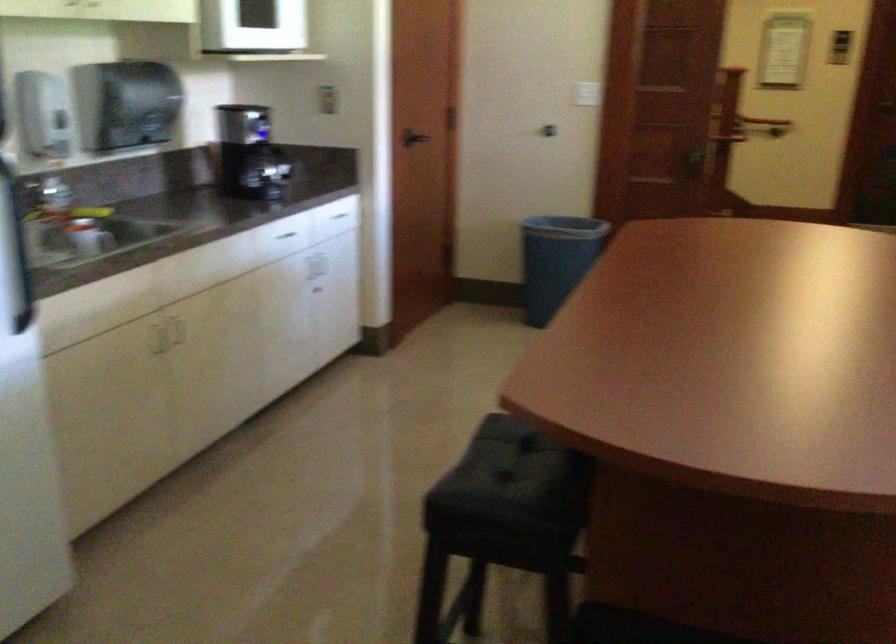
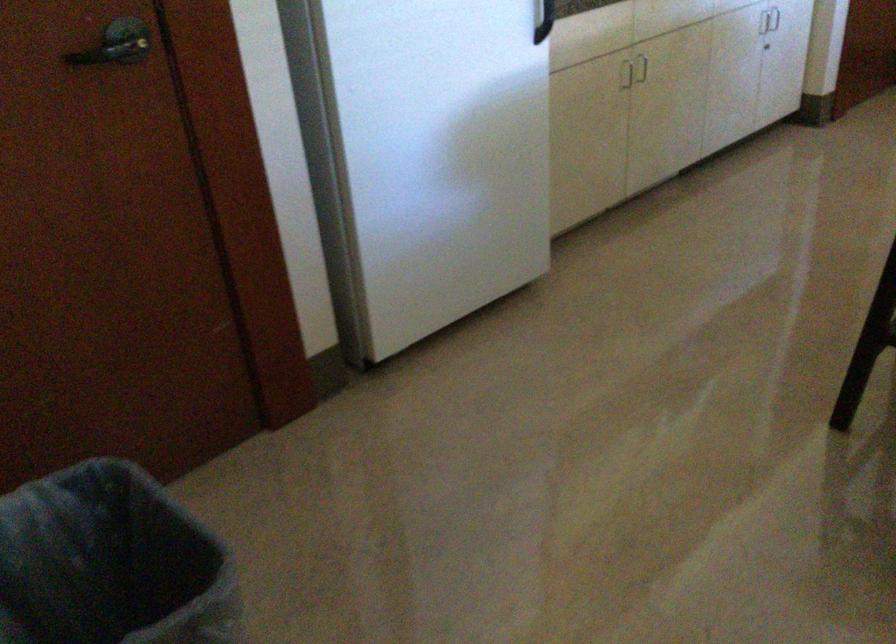
The point at (278, 274) is marked in the first image. Where is the corresponding point in the second image?

(769, 20)